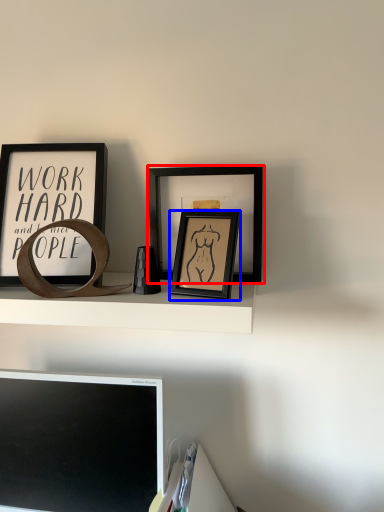
Question: Among these objects, which one is farthest to the camera, picture frame (highlighted by a red box) or picture frame (highlighted by a blue box)?

Choices:
 (A) picture frame
 (B) picture frame

Answer: (A)